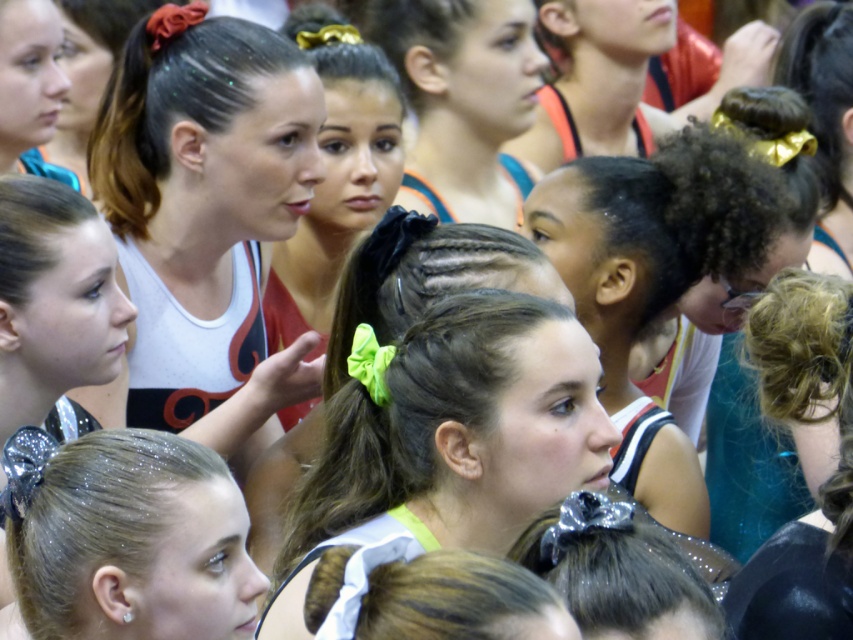
You are a photographer trying to capture a clear shot of the teal shiny hair at center and the matte white tank top at upper left. Which object should you focus on first if you want to ensure both are in focus?

The matte white tank top at upper left should be focused on first because it is closer to the camera than the teal shiny hair at center, which is further away. By focusing on the closer object, the further one will also be in focus.

You are a photographer positioned to the side of the group. You need to capture a shot where both the shiny dark brown hair at center and the matte white tank top at upper left are visible. Based on their heights, which object should you focus on first to ensure both are in frame?

Since the shiny dark brown hair at center is taller than the matte white tank top at upper left, you should focus on the shiny dark brown hair at center first to ensure both are in frame.